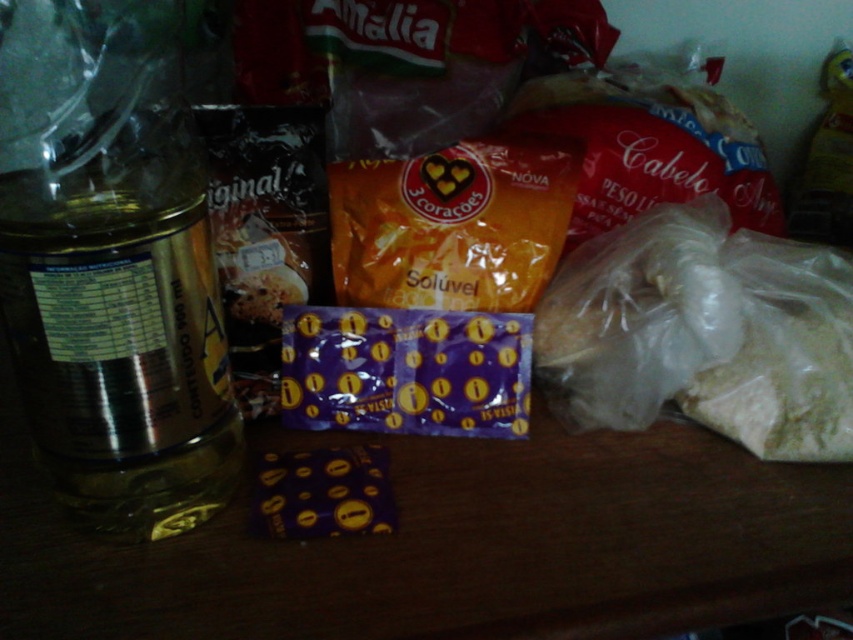
Locate an element on the screen. Image resolution: width=853 pixels, height=640 pixels. white powder at right is located at coordinates (701, 333).

Does white powder at right have a lesser width compared to orange matte packet at center?

No, white powder at right is not thinner than orange matte packet at center.

Describe the element at coordinates (701, 333) in the screenshot. I see `white powder at right` at that location.

Where is `white powder at right`? This screenshot has width=853, height=640. white powder at right is located at coordinates (701, 333).

Is metallic gold bottle at left to the left of white powder at right from the viewer's perspective?

Indeed, metallic gold bottle at left is positioned on the left side of white powder at right.

Does metallic gold bottle at left have a smaller size compared to white powder at right?

No.

Between point (148, 387) and point (772, 428), which one is positioned behind?

The point (772, 428) is more distant.

Where is `metallic gold bottle at left`? metallic gold bottle at left is located at coordinates (112, 266).

Does metallic gold bottle at left appear over orange matte packet at center?

No.

Describe the element at coordinates (112, 266) in the screenshot. I see `metallic gold bottle at left` at that location.

At what (x,y) coordinates should I click in order to perform the action: click on metallic gold bottle at left. Please return your answer as a coordinate pair (x, y). Image resolution: width=853 pixels, height=640 pixels. Looking at the image, I should click on (112, 266).